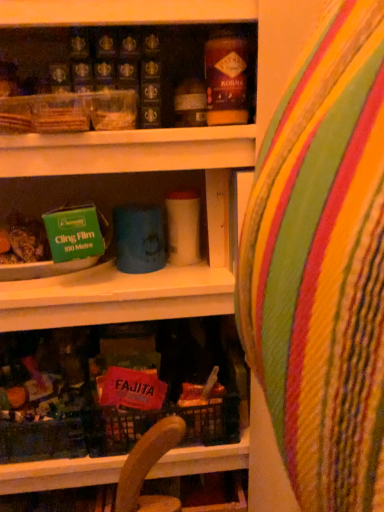
Question: Considering the relative sizes of multicolored striped bean bag chair at center and matte brown jar at upper center in the image provided, is multicolored striped bean bag chair at center wider than matte brown jar at upper center?

Choices:
 (A) yes
 (B) no

Answer: (A)

Question: Is multicolored striped bean bag chair at center touching matte brown jar at upper center?

Choices:
 (A) no
 (B) yes

Answer: (A)

Question: Is multicolored striped bean bag chair at center facing away from matte brown jar at upper center?

Choices:
 (A) no
 (B) yes

Answer: (A)

Question: Is multicolored striped bean bag chair at center not near matte brown jar at upper center?

Choices:
 (A) yes
 (B) no

Answer: (B)

Question: From a real-world perspective, is multicolored striped bean bag chair at center on top of matte brown jar at upper center?

Choices:
 (A) yes
 (B) no

Answer: (B)

Question: Is multicolored striped bean bag chair at center to the right of matte brown jar at upper center from the viewer's perspective?

Choices:
 (A) yes
 (B) no

Answer: (A)

Question: Considering the relative sizes of matte brown jar at upper center and multicolored striped bean bag chair at center in the image provided, is matte brown jar at upper center smaller than multicolored striped bean bag chair at center?

Choices:
 (A) no
 (B) yes

Answer: (B)

Question: Is matte brown jar at upper center positioned behind multicolored striped bean bag chair at center?

Choices:
 (A) yes
 (B) no

Answer: (A)

Question: Is matte brown jar at upper center positioned beyond the bounds of multicolored striped bean bag chair at center?

Choices:
 (A) yes
 (B) no

Answer: (A)

Question: Is multicolored striped bean bag chair at center at the back of matte brown jar at upper center?

Choices:
 (A) no
 (B) yes

Answer: (A)

Question: Does matte brown jar at upper center have a larger size compared to multicolored striped bean bag chair at center?

Choices:
 (A) yes
 (B) no

Answer: (B)

Question: From the image's perspective, is matte brown jar at upper center above multicolored striped bean bag chair at center?

Choices:
 (A) no
 (B) yes

Answer: (B)

Question: From a real-world perspective, is matte brown jar at upper center positioned above or below multicolored striped bean bag chair at center?

Choices:
 (A) above
 (B) below

Answer: (A)